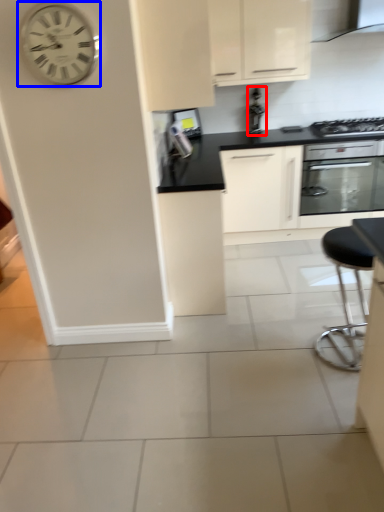
Question: Which object is closer to the camera taking this photo, appliance (highlighted by a red box) or wall clock (highlighted by a blue box)?

Choices:
 (A) appliance
 (B) wall clock

Answer: (B)